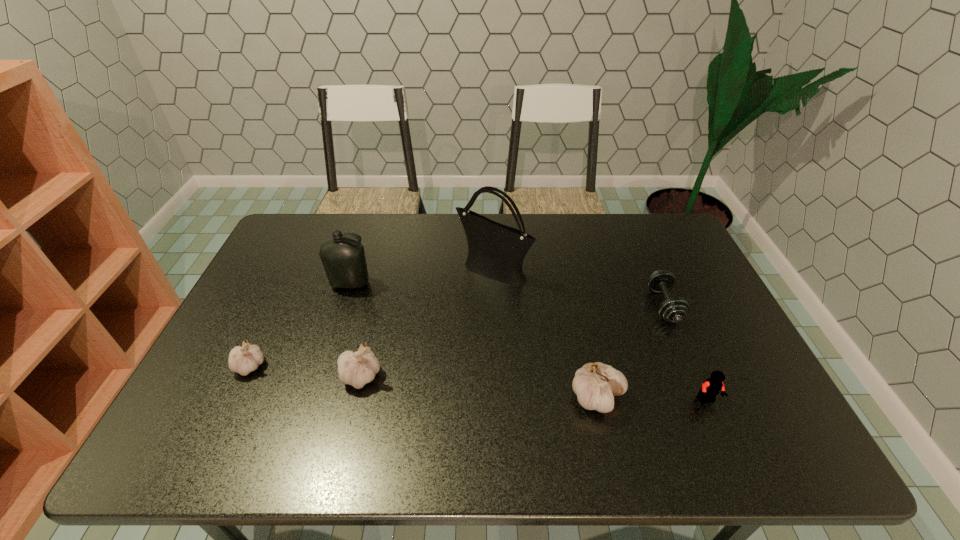
At what (x,y) coordinates should I click in order to perform the action: click on the shortest object. Please return your answer as a coordinate pair (x, y). This screenshot has height=540, width=960. Looking at the image, I should click on (674, 310).

At what (x,y) coordinates should I click in order to perform the action: click on free point located 0.110m on the back of the leftmost object. Please return your answer as a coordinate pair (x, y). Image resolution: width=960 pixels, height=540 pixels. Looking at the image, I should click on click(x=271, y=322).

The image size is (960, 540). What are the coordinates of `free location located 0.050m on the left of the second garlic from left to right` in the screenshot? It's located at (320, 376).

Locate an element on the screen. The image size is (960, 540). free region located 0.100m on the right of the tallest garlic is located at coordinates (665, 397).

Image resolution: width=960 pixels, height=540 pixels. What are the coordinates of `vacant space located 0.390m on the right of the shoulder bag` in the screenshot? It's located at (651, 271).

Find the location of a particular element. free space located on the front of the bottle is located at coordinates (331, 342).

Where is `vacant point located 0.250m on the left of the dumbbell`? Image resolution: width=960 pixels, height=540 pixels. vacant point located 0.250m on the left of the dumbbell is located at coordinates (564, 306).

You are a GUI agent. You are given a task and a screenshot of the screen. Output one action in this format:
    pyautogui.click(x=<x>, y=<y>)
    Task: Click on the object present at the far edge
    
    Given the screenshot: What is the action you would take?
    pyautogui.click(x=496, y=251)

This screenshot has height=540, width=960. Identify the location of Lego at the near edge. (712, 386).

Identify the location of object located in the left edge section of the desktop. point(243,360).